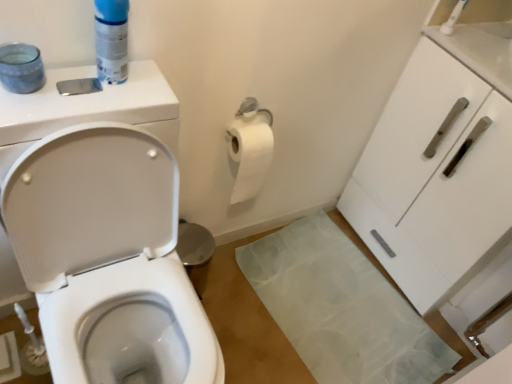
Locate an element on the screen. The width and height of the screenshot is (512, 384). spots to the right of blue plastic can at upper left is located at coordinates (144, 89).